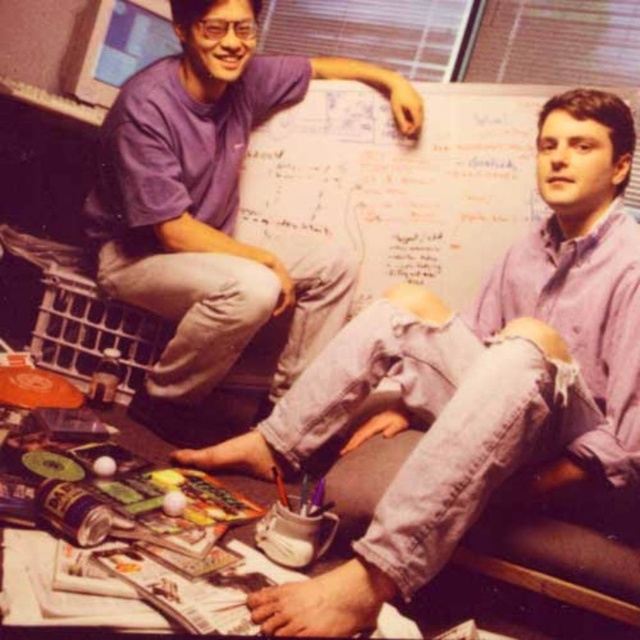
In the scene where two people are collaborating at a workspace with a whiteboard, which object is positioned to the right of the other between the denim jeans at center and the purple cotton shirt at upper left?

The denim jeans at center is positioned to the right of the purple cotton shirt at upper left.

You are standing in front of the workspace. Which object is closer to you, the denim jeans at center or the purple cotton shirt at upper left?

The denim jeans at center is closer to the viewer than the purple cotton shirt at upper left.

You are a delivery robot with a package that needs to be placed between the denim jeans at center and the purple cotton shirt at upper left. The package is 24 inches long. Will it fit between them?

The distance between the denim jeans at center and the purple cotton shirt at upper left is 26.01 inches. Since the package is 24 inches long, it will fit with about 2 inches of space remaining.